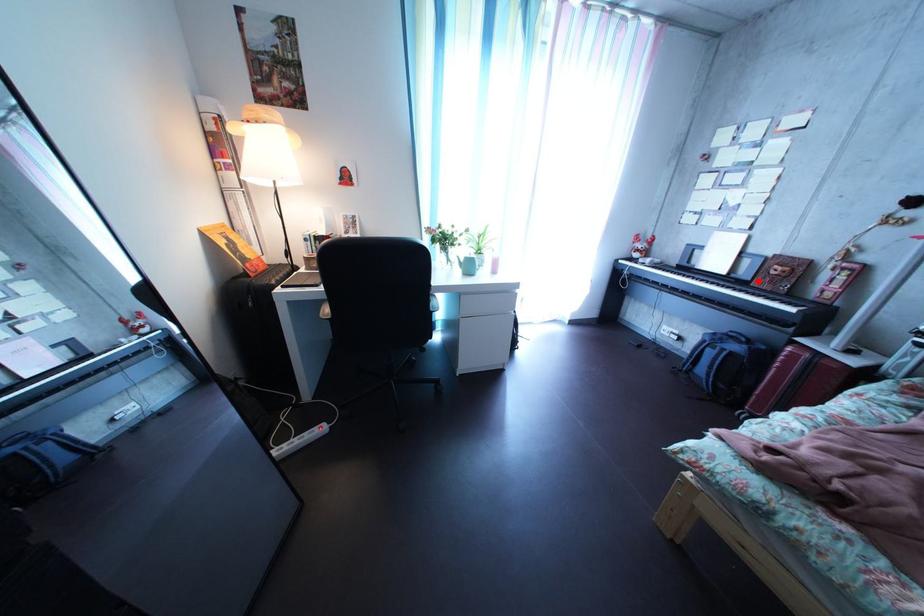
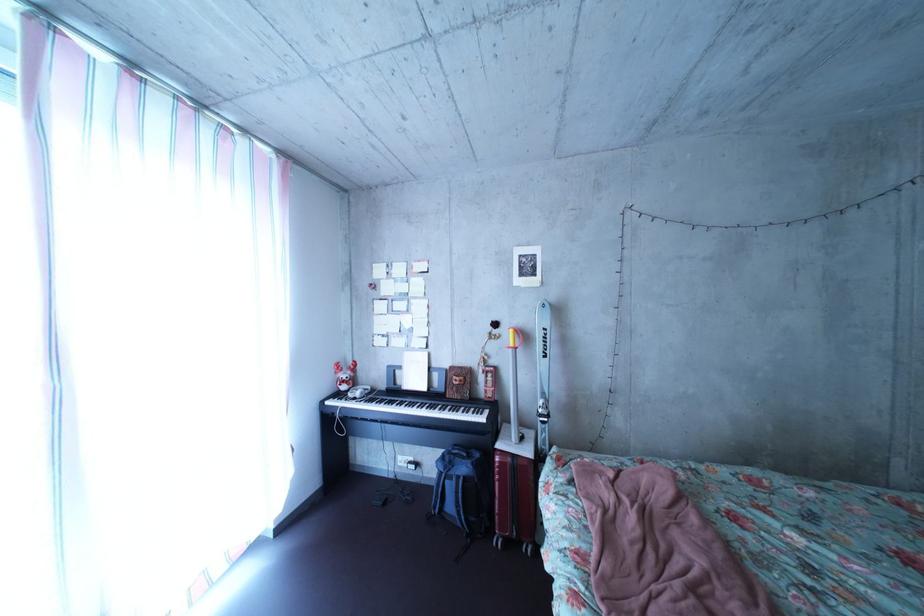
Question: I am providing you with two images of the same scene from different viewpoints. A red point is shown in image1. For the corresponding object point in image2, is it positioned nearer or farther from the camera?

Choices:
 (A) Nearer
 (B) Farther

Answer: (B)